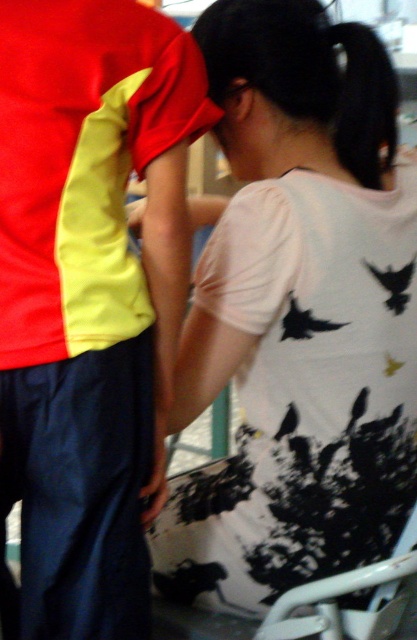
Who is more forward, (x=288, y=454) or (x=32, y=58)?

Point (x=32, y=58) is more forward.

Does white matte shirt at center have a lesser width compared to matte red-yellow shirt at center?

In fact, white matte shirt at center might be wider than matte red-yellow shirt at center.

Identify the location of white matte shirt at center. The width and height of the screenshot is (417, 640). (298, 316).

What are the coordinates of `white matte shirt at center` in the screenshot? It's located at (298, 316).